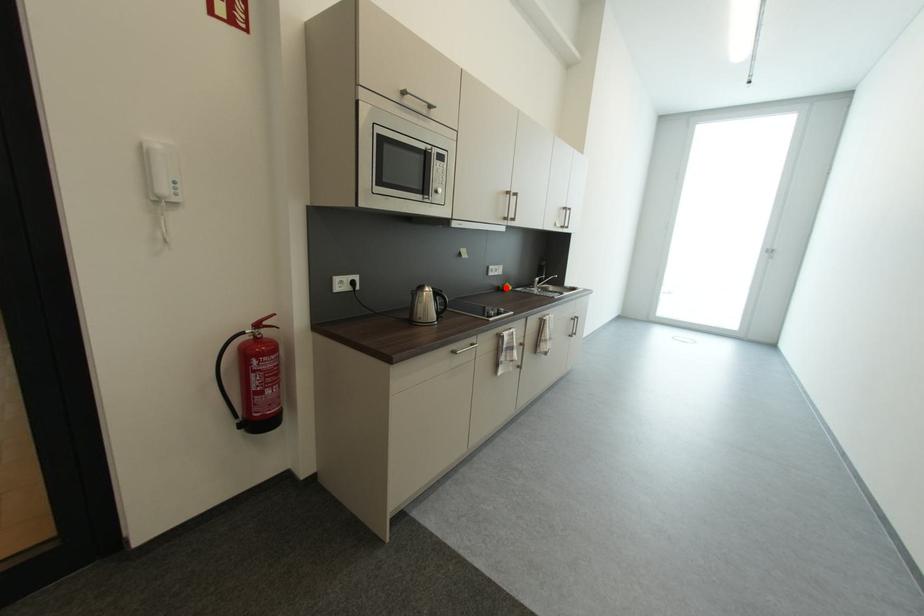
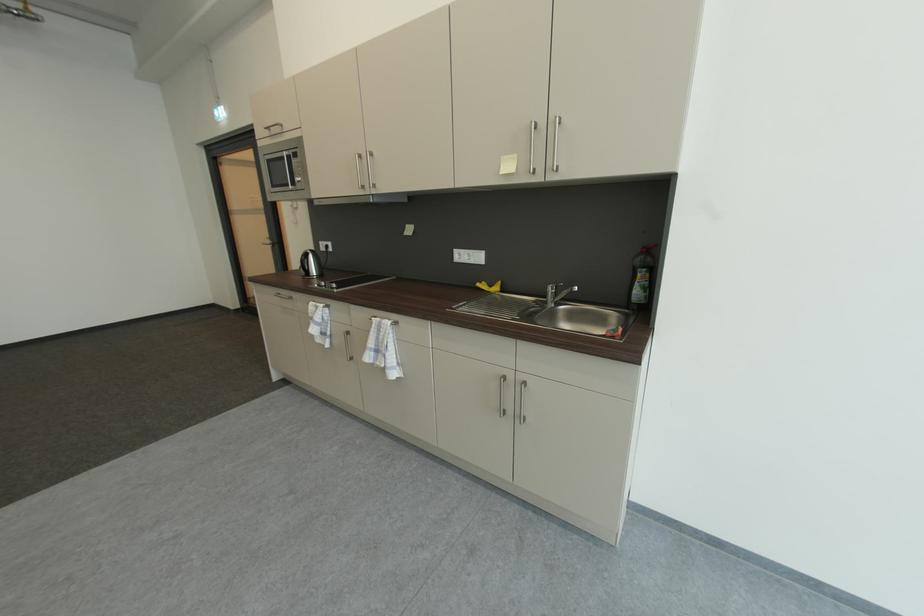
Question: I am providing you with two images of the same scene from different viewpoints. A red point is marked on the first image. Is the red point's position out of view in image 2?

Choices:
 (A) Yes
 (B) No

Answer: (B)